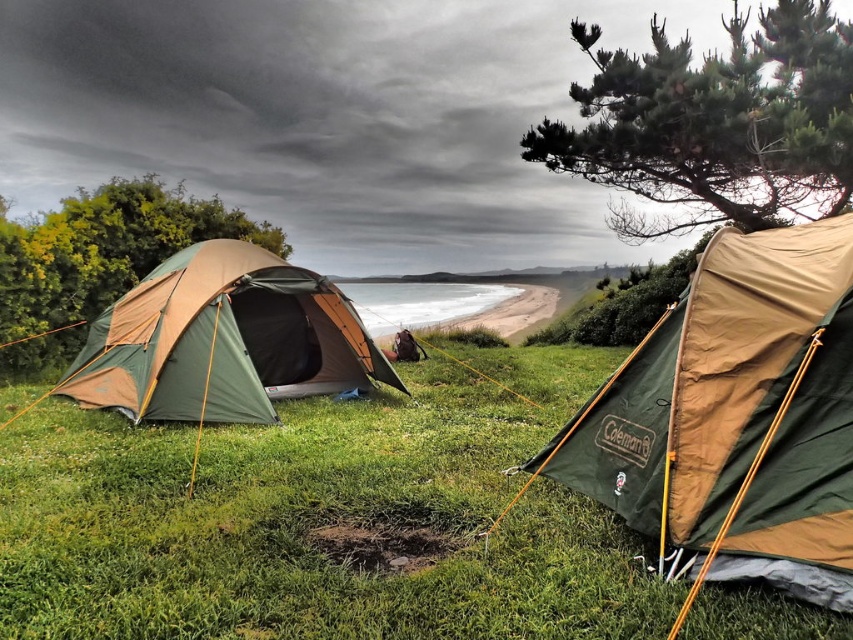
I want to click on green fabric tent at center, so click(730, 410).

Between point (831, 273) and point (111, 253), which one is positioned behind?

Positioned behind is point (111, 253).

Is point (645, 390) more distant than point (0, 308)?

No, it is not.

Where is `green fabric tent at center`? green fabric tent at center is located at coordinates [730, 410].

What do you see at coordinates (323, 518) in the screenshot?
I see `green grassy at center` at bounding box center [323, 518].

Is point (556, 362) positioned before point (103, 205)?

No, (556, 362) is further to viewer.

Where is `green grassy at center`? green grassy at center is located at coordinates (323, 518).

Who is taller, green grassy at center or green fabric tent at center?

Standing taller between the two is green fabric tent at center.

Consider the image. Who is higher up, green grassy at center or green fabric tent at center?

green fabric tent at center is above.

Who is more forward, (x=509, y=605) or (x=618, y=512)?

Point (x=509, y=605) is in front.

Image resolution: width=853 pixels, height=640 pixels. Identify the location of green grassy at center. (323, 518).